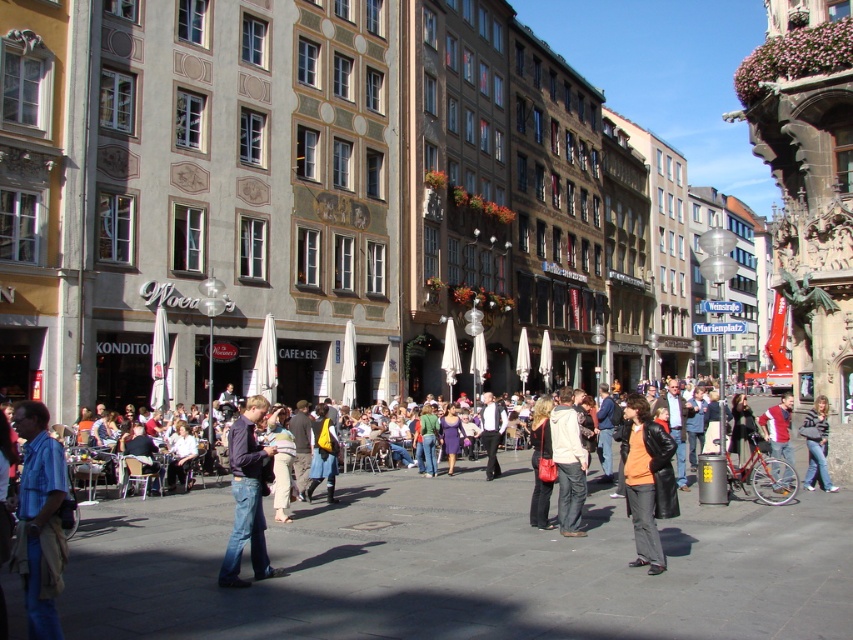
Is point (563, 420) positioned before point (321, 461)?

Yes.

Is light beige jacket at center closer to camera compared to yellow backpack at center?

Yes, it is.

What are the coordinates of `light beige jacket at center` in the screenshot? It's located at (567, 464).

Is orange matte jacket at center bigger than yellow backpack at center?

Yes, orange matte jacket at center is bigger than yellow backpack at center.

Between point (636, 401) and point (310, 481), which one is positioned in front?

Point (636, 401) is more forward.

Where is `orange matte jacket at center`? The width and height of the screenshot is (853, 640). orange matte jacket at center is located at coordinates (647, 481).

Between point (306, 497) and point (776, 424), which one is positioned behind?

The point (776, 424) is behind.

Between yellow backpack at center and red jacket at center, which one is positioned higher?

yellow backpack at center is above.

The height and width of the screenshot is (640, 853). Describe the element at coordinates (323, 454) in the screenshot. I see `yellow backpack at center` at that location.

At what (x,y) coordinates should I click in order to perform the action: click on yellow backpack at center. Please return your answer as a coordinate pair (x, y). The image size is (853, 640). Looking at the image, I should click on (323, 454).